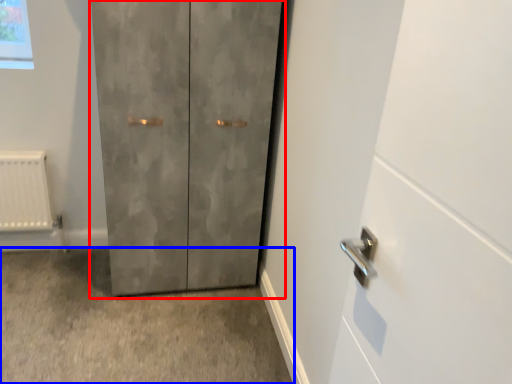
Question: Among these objects, which one is farthest to the camera, door (highlighted by a red box) or concrete (highlighted by a blue box)?

Choices:
 (A) door
 (B) concrete

Answer: (A)